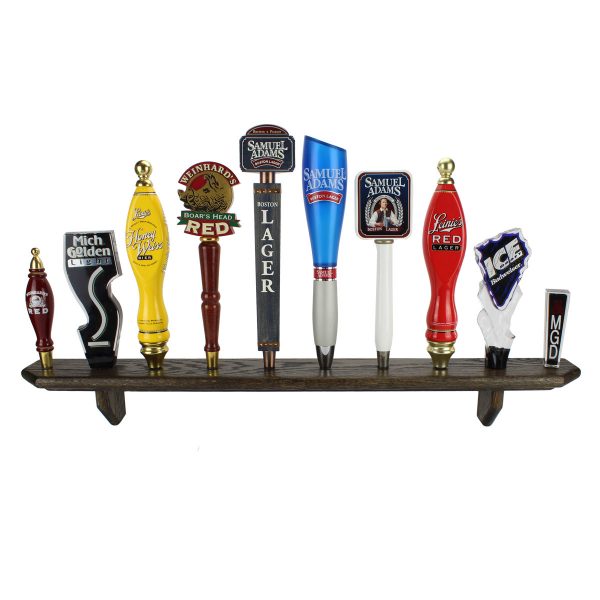
Locate an element on the screen. beer tap handle is located at coordinates (39, 316), (98, 303), (155, 279), (209, 274), (265, 267), (329, 234), (383, 216), (446, 272), (502, 287), (553, 308).